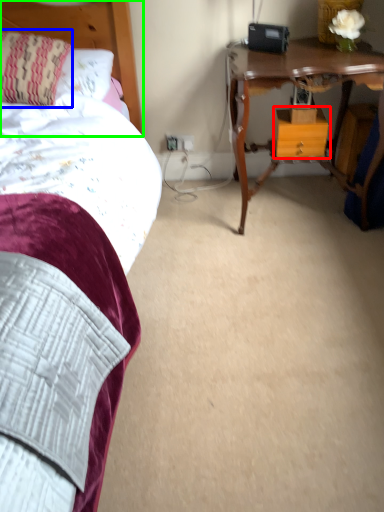
Question: Which object is positioned farthest from nightstand (highlighted by a red box)? Select from pillow (highlighted by a blue box) and headboard (highlighted by a green box).

Choices:
 (A) pillow
 (B) headboard

Answer: (A)